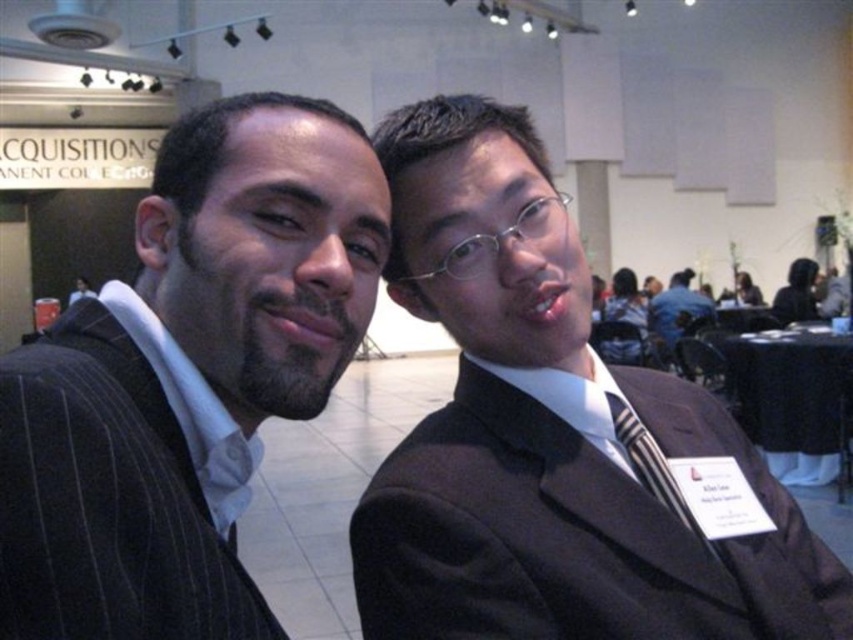
You are organizing a formal event and need to ensure that all participants have their attire properly coordinated. Given the image of two individuals at a formal event, which object is shorter in height between the striped fabric tie at center and the dark brown suit at center?

The striped fabric tie at center has a lesser height compared to the dark brown suit at center, so the striped fabric tie at center is shorter in height.

You are organizing a photo shoot and need to arrange two suits for a photoshoot setup. The dark pinstripe suit at left and the dark brown suit at center are available. Based on their sizes, which one should be placed on the larger mannequin?

The dark brown suit at center should be placed on the larger mannequin since it is bigger than the dark pinstripe suit at left.

You are at a networking event and need to identify the person wearing the striped fabric tie at center and the dark brown suit at center. Based on their positions, which one is closer to the left side of the image?

The striped fabric tie at center is to the left of dark brown suit at center, so the striped fabric tie at center is closer to the left side of the image.